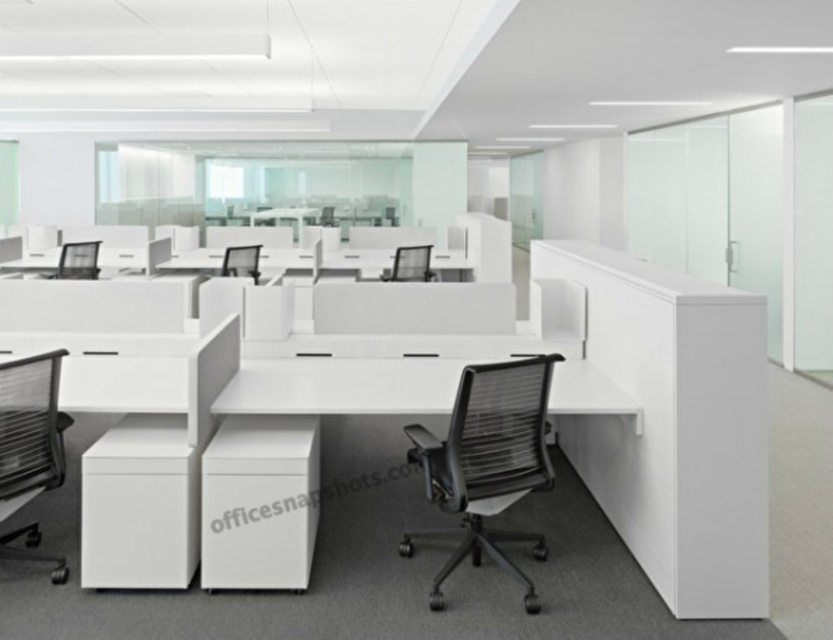
Question: Which of the following is the farthest from the observer?

Choices:
 (A) black mesh chair at center
 (B) black mesh swivel chair at center

Answer: (A)

Question: Does black mesh swivel chair at center appear under black mesh chair at center?

Choices:
 (A) yes
 (B) no

Answer: (A)

Question: Considering the relative positions of black mesh swivel chair at center and white matte desk at center in the image provided, where is black mesh swivel chair at center located with respect to white matte desk at center?

Choices:
 (A) below
 (B) above

Answer: (A)

Question: Which of the following is the closest to the observer?

Choices:
 (A) white matte desk at center
 (B) black mesh swivel chair at left

Answer: (B)

Question: Is black mesh swivel chair at center smaller than black mesh swivel chair at left?

Choices:
 (A) yes
 (B) no

Answer: (B)

Question: Which object is farther from the camera taking this photo?

Choices:
 (A) black mesh swivel chair at center
 (B) black mesh chair at center

Answer: (B)